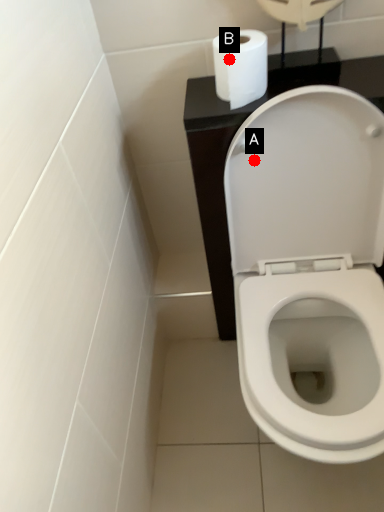
Question: Two points are circled on the image, labeled by A and B beside each circle. Which point is farther to the camera?

Choices:
 (A) A is further
 (B) B is further

Answer: (A)